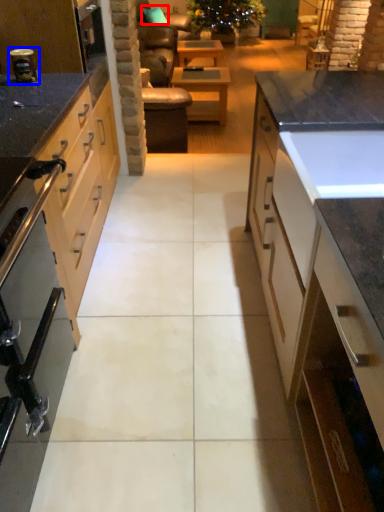
Question: Which object appears farthest to the camera in this image, pillow (highlighted by a red box) or appliance (highlighted by a blue box)?

Choices:
 (A) pillow
 (B) appliance

Answer: (A)